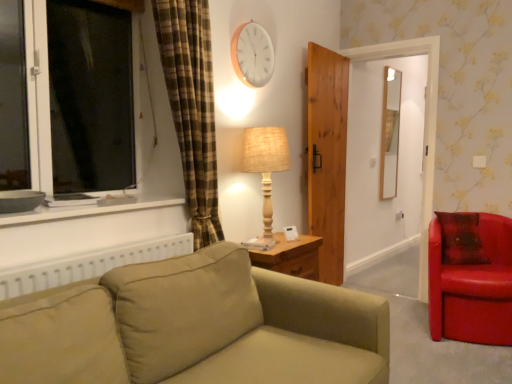
Question: Should I look upward or downward to see wooden door at center?

Choices:
 (A) up
 (B) down

Answer: (A)

Question: Is shiny leather armchair at right further to camera compared to wooden clock at upper center?

Choices:
 (A) yes
 (B) no

Answer: (B)

Question: From a real-world perspective, is shiny leather armchair at right located beneath wooden clock at upper center?

Choices:
 (A) yes
 (B) no

Answer: (A)

Question: Is wooden clock at upper center surrounded by shiny leather armchair at right?

Choices:
 (A) yes
 (B) no

Answer: (B)

Question: Is wooden clock at upper center at the back of shiny leather armchair at right?

Choices:
 (A) yes
 (B) no

Answer: (B)

Question: Considering the relative sizes of shiny leather armchair at right and wooden clock at upper center in the image provided, is shiny leather armchair at right wider than wooden clock at upper center?

Choices:
 (A) no
 (B) yes

Answer: (B)

Question: From a real-world perspective, is shiny leather armchair at right positioned over wooden clock at upper center based on gravity?

Choices:
 (A) no
 (B) yes

Answer: (A)

Question: Can wooden door at center be found inside matte gray bowl at left?

Choices:
 (A) yes
 (B) no

Answer: (B)

Question: Is matte gray bowl at left outside of wooden door at center?

Choices:
 (A) yes
 (B) no

Answer: (A)

Question: Considering the relative sizes of matte gray bowl at left and wooden door at center in the image provided, is matte gray bowl at left bigger than wooden door at center?

Choices:
 (A) yes
 (B) no

Answer: (B)

Question: Is matte gray bowl at left positioned in front of wooden door at center?

Choices:
 (A) yes
 (B) no

Answer: (A)

Question: Can you confirm if matte gray bowl at left is shorter than wooden door at center?

Choices:
 (A) yes
 (B) no

Answer: (A)

Question: Are matte gray bowl at left and wooden door at center far apart?

Choices:
 (A) no
 (B) yes

Answer: (B)

Question: From a real-world perspective, is woven beige lamp at center physically below matte gray bowl at left?

Choices:
 (A) no
 (B) yes

Answer: (A)